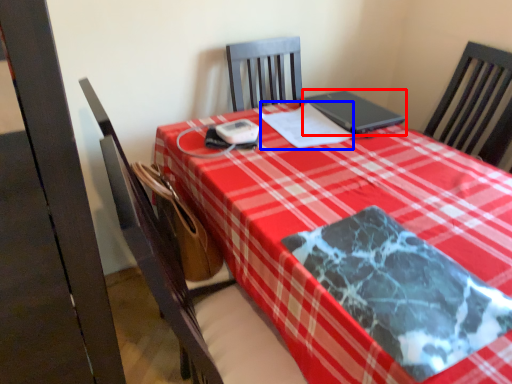
Question: Among these objects, which one is farthest to the camera, laptop (highlighted by a red box) or notebook (highlighted by a blue box)?

Choices:
 (A) laptop
 (B) notebook

Answer: (A)